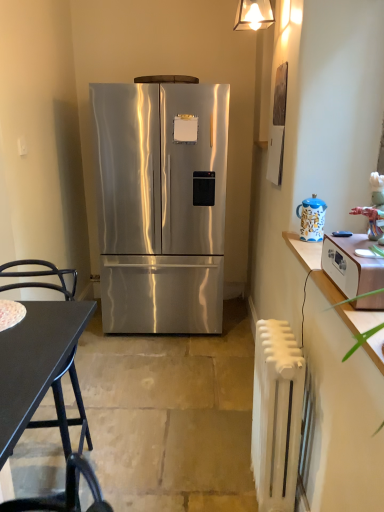
Question: Is blue ceramic teapot at right smaller than white painted metal radiator at right?

Choices:
 (A) yes
 (B) no

Answer: (A)

Question: Does blue ceramic teapot at right have a greater width compared to white painted metal radiator at right?

Choices:
 (A) yes
 (B) no

Answer: (B)

Question: Is blue ceramic teapot at right at the right side of white painted metal radiator at right?

Choices:
 (A) yes
 (B) no

Answer: (A)

Question: Is blue ceramic teapot at right at the left side of white painted metal radiator at right?

Choices:
 (A) yes
 (B) no

Answer: (B)

Question: Is blue ceramic teapot at right positioned behind white painted metal radiator at right?

Choices:
 (A) no
 (B) yes

Answer: (B)

Question: From a real-world perspective, is blue ceramic teapot at right positioned over white painted metal radiator at right based on gravity?

Choices:
 (A) yes
 (B) no

Answer: (A)

Question: Does white painted metal radiator at right have a greater width compared to stainless steel refrigerator at center?

Choices:
 (A) yes
 (B) no

Answer: (B)

Question: From the image's perspective, is white painted metal radiator at right under stainless steel refrigerator at center?

Choices:
 (A) no
 (B) yes

Answer: (B)

Question: Is white painted metal radiator at right oriented away from stainless steel refrigerator at center?

Choices:
 (A) yes
 (B) no

Answer: (B)

Question: Does white painted metal radiator at right lie in front of stainless steel refrigerator at center?

Choices:
 (A) no
 (B) yes

Answer: (B)

Question: Is white painted metal radiator at right further to the viewer compared to stainless steel refrigerator at center?

Choices:
 (A) no
 (B) yes

Answer: (A)

Question: Does white painted metal radiator at right touch stainless steel refrigerator at center?

Choices:
 (A) yes
 (B) no

Answer: (B)

Question: Does blue ceramic teapot at right have a greater width compared to black matte desk at lower left?

Choices:
 (A) yes
 (B) no

Answer: (B)